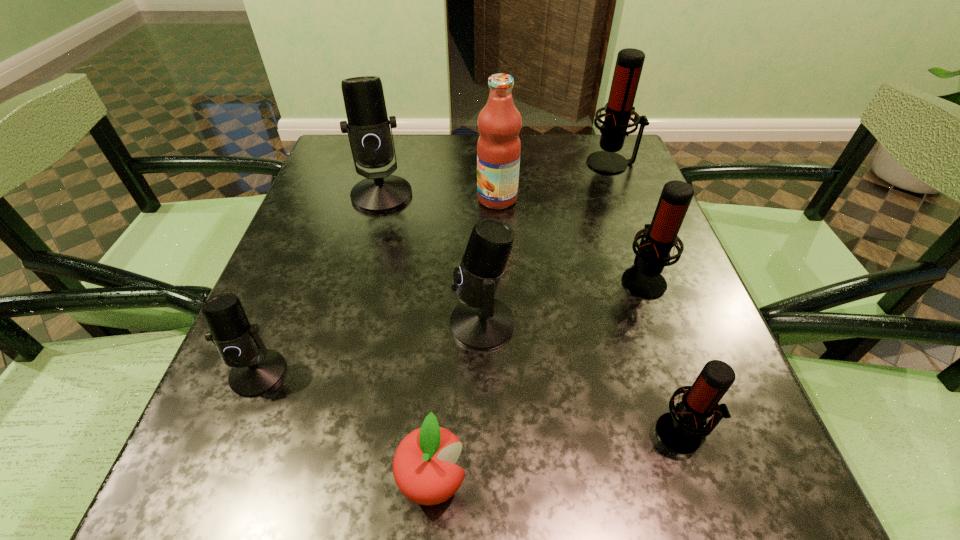
Where is `the smallest red microphone`? The width and height of the screenshot is (960, 540). the smallest red microphone is located at coordinates (681, 431).

Identify the location of the leftmost microphone. click(x=255, y=370).

At what (x,y) coordinates should I click in order to perform the action: click on the fifth farthest microphone. Please return your answer as a coordinate pair (x, y). The width and height of the screenshot is (960, 540). Looking at the image, I should click on (255, 370).

You are a GUI agent. You are given a task and a screenshot of the screen. Output one action in this format:
    pyautogui.click(x=<x>, y=<y>)
    Task: Click on the apple
    This screenshot has height=540, width=960.
    Given the screenshot: What is the action you would take?
    pyautogui.click(x=424, y=469)

You are a GUI agent. You are given a task and a screenshot of the screen. Output one action in this format:
    pyautogui.click(x=<x>, y=<y>)
    Task: Click on the shortest object
    
    Given the screenshot: What is the action you would take?
    pyautogui.click(x=424, y=469)

You are a GUI agent. You are given a task and a screenshot of the screen. Output one action in this format:
    pyautogui.click(x=<x>, y=<y>)
    Task: Click on the free region located 0.160m on the front label of the fruit juice
    The image size is (960, 540).
    Given the screenshot: What is the action you would take?
    pyautogui.click(x=408, y=199)

What are the coordinates of `free space located 0.130m on the front label of the fruit juice` in the screenshot? It's located at (420, 199).

This screenshot has height=540, width=960. What are the coordinates of `free spot located 0.320m on the front label of the fruit juice` in the screenshot? It's located at [x=339, y=199].

You are a GUI agent. You are given a task and a screenshot of the screen. Output one action in this format:
    pyautogui.click(x=<x>, y=<y>)
    Task: Click on the free space located on the left of the biggest red microphone
    
    Given the screenshot: What is the action you would take?
    [x=481, y=163]

Identify the location of vacant space located on the stand of the fifth nearest microphone. click(x=347, y=328).